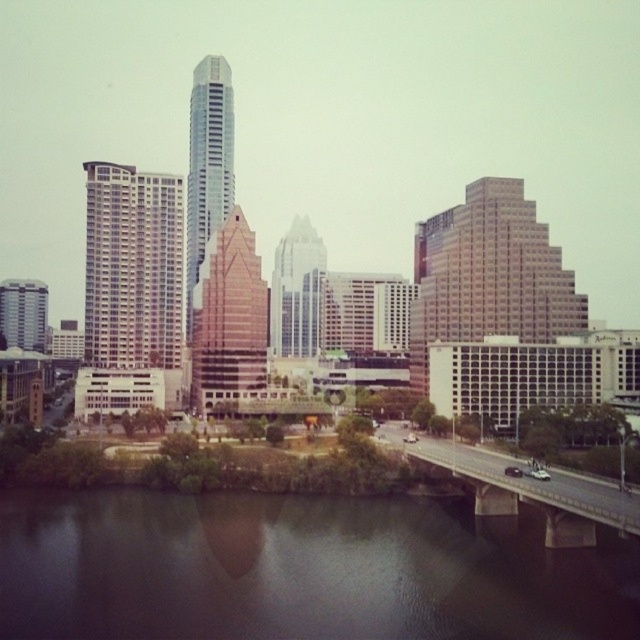
You are standing at the center of the bridge and want to find the dark reflective water at lower center. In which direction should you look to see it?

The dark reflective water at lower center is located at point [300,570], so you should look downward towards the lower part of the scene to see it.

Consider the image. You are standing at the riverbank and want to take a photo of both point (100, 189) and point (204, 65) in the cityscape. Which point should you focus on first to ensure both are in clear view?

You should focus on point (100, 189) first because it is closer to the camera than point (204, 65), ensuring both points are in clear view.